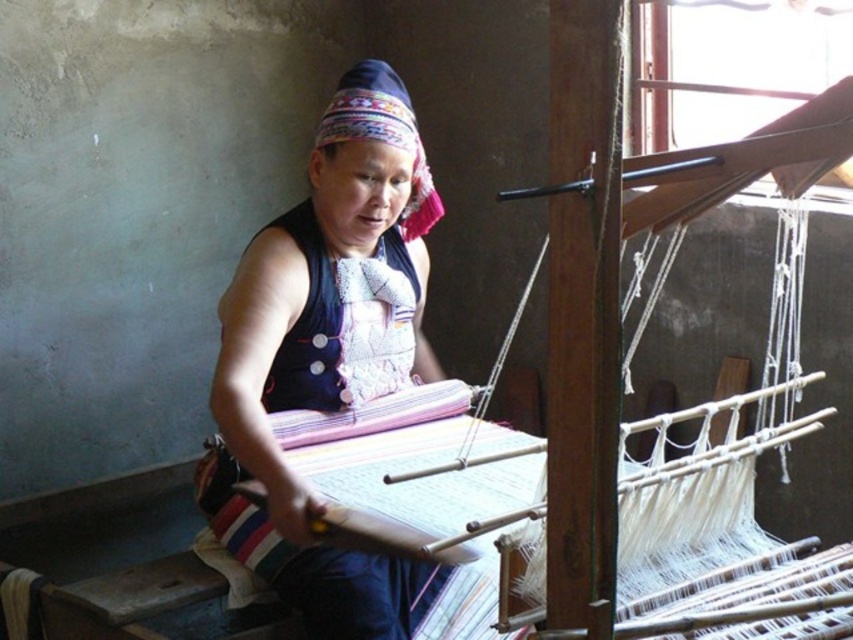
Question: Does matte black fabric at center appear on the right side of blue fabric apron at center?

Choices:
 (A) yes
 (B) no

Answer: (A)

Question: Does matte black fabric at center lie in front of blue fabric apron at center?

Choices:
 (A) no
 (B) yes

Answer: (B)

Question: Does matte black fabric at center have a lesser width compared to blue fabric apron at center?

Choices:
 (A) yes
 (B) no

Answer: (B)

Question: Which object appears closest to the camera in this image?

Choices:
 (A) matte black fabric at center
 (B) blue fabric apron at center
 (C) embroidered fabric headscarf at center

Answer: (A)

Question: Which of the following is the closest to the observer?

Choices:
 (A) matte black fabric at center
 (B) embroidered fabric headscarf at center
 (C) blue fabric apron at center

Answer: (A)

Question: Which object is positioned closest to the blue fabric apron at center?

Choices:
 (A) matte black fabric at center
 (B) embroidered fabric headscarf at center

Answer: (A)